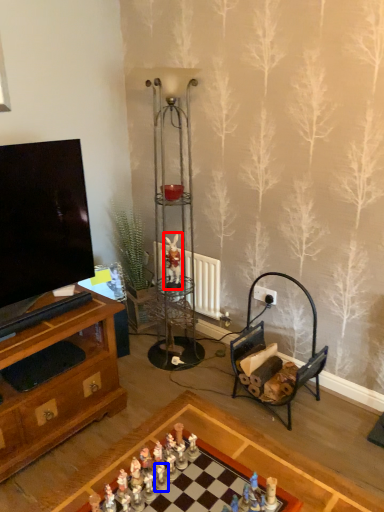
Question: Which object appears closest to the camera in this image, miniature (highlighted by a red box) or toy (highlighted by a blue box)?

Choices:
 (A) miniature
 (B) toy

Answer: (B)